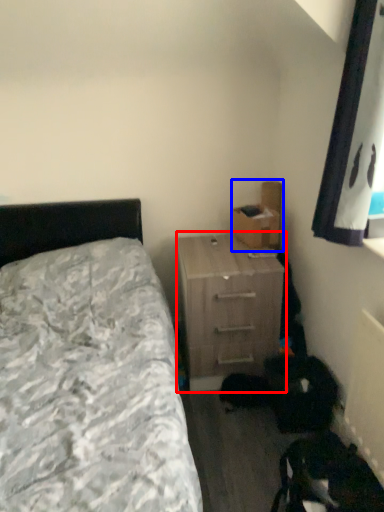
Question: Which point is closer to the camera, nightstand (highlighted by a red box) or cardboard box (highlighted by a blue box)?

Choices:
 (A) nightstand
 (B) cardboard box

Answer: (A)